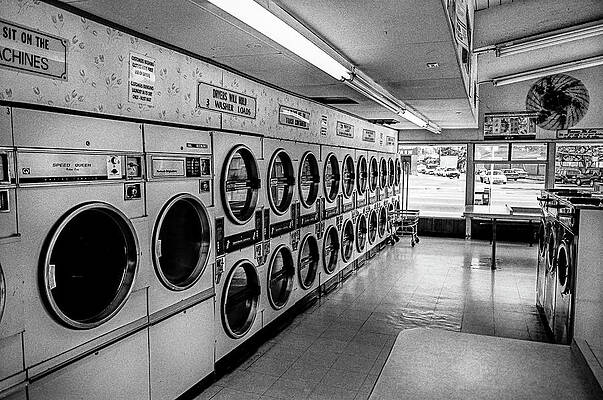
Locate an element on the screen. This screenshot has height=400, width=603. lights is located at coordinates (257, 26), (371, 88), (409, 120).